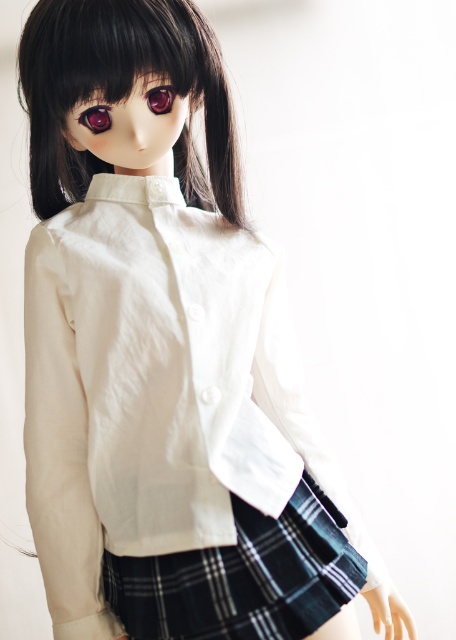
Based on the scene description, can you determine the spatial relationship between the black plaid kilt at center and the glossy plastic eye at upper left?

The black plaid kilt at center is located below the glossy plastic eye at upper left.

You are an art restorer examining a doll with two glossy plastic eyes. The doll has a glossy plastic eye at upper left and a glossy plastic eye at upper center. Which eye has a larger height?

The glossy plastic eye at upper left has a greater height compared to the glossy plastic eye at upper center.

You are a toy designer who needs to create a protective case for the doll. The case must accommodate both the black silky hair at upper center and the glossy plastic eye at upper left. What is the minimum distance the case should have between these two features to ensure they fit comfortably?

The minimum distance should be at least 13.32 centimeters to accommodate the space between the black silky hair at upper center and the glossy plastic eye at upper left.